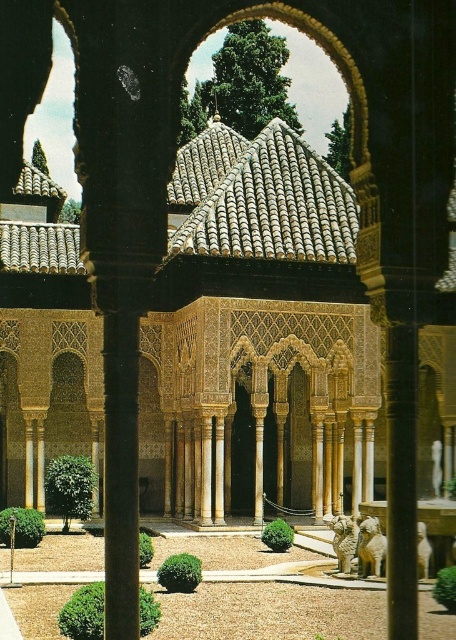
Question: Is brown textured gravel at center bigger than white marble column at center?

Choices:
 (A) yes
 (B) no

Answer: (A)

Question: Among these points, which one is farthest from the camera?

Choices:
 (A) (0, 550)
 (B) (207, 460)

Answer: (B)

Question: Which point appears closest to the camera in this image?

Choices:
 (A) (295, 593)
 (B) (201, 429)

Answer: (A)

Question: Can you confirm if brown textured gravel at center is positioned below white marble column at center?

Choices:
 (A) yes
 (B) no

Answer: (A)

Question: Observing the image, what is the correct spatial positioning of brown textured gravel at center in reference to white marble column at center?

Choices:
 (A) below
 (B) above

Answer: (A)